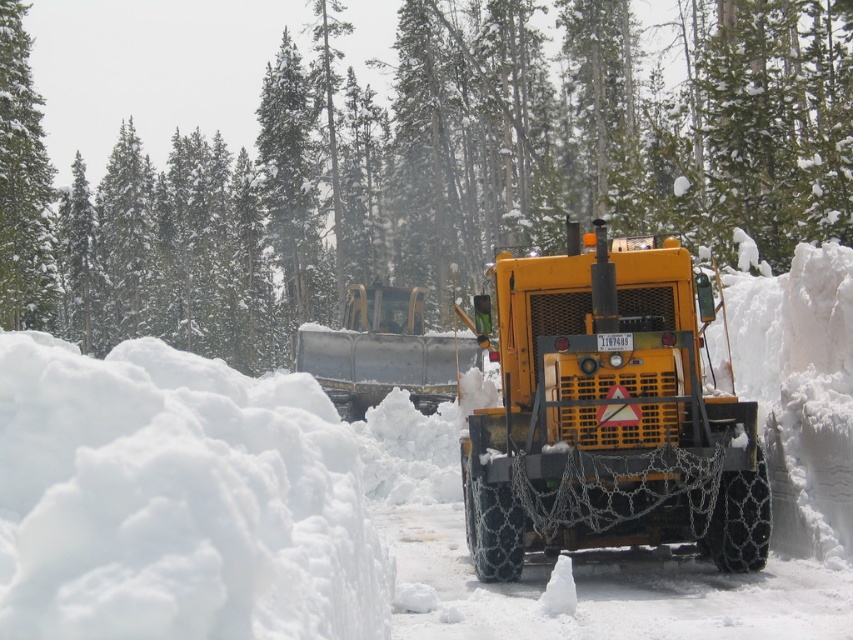
Question: From the image, what is the correct spatial relationship of white fluffy snow at center in relation to green textured tree at upper left?

Choices:
 (A) left
 (B) right

Answer: (B)

Question: Is yellow matte tractor at center smaller than metallic silver plow at center?

Choices:
 (A) no
 (B) yes

Answer: (B)

Question: Which of the following is the farthest from the observer?

Choices:
 (A) white fluffy snow at center
 (B) green textured pine at center
 (C) yellow matte tractor at center

Answer: (B)

Question: Does white fluffy snow at center have a greater width compared to white fluffy snow at left?

Choices:
 (A) yes
 (B) no

Answer: (A)

Question: Which point is farther to the camera?

Choices:
 (A) white fluffy snow at center
 (B) green textured tree at upper left
 (C) white fluffy snow at left

Answer: (B)

Question: Which point appears farthest from the camera in this image?

Choices:
 (A) (90, 552)
 (B) (463, 369)
 (C) (274, 260)
 (D) (352, 449)

Answer: (C)